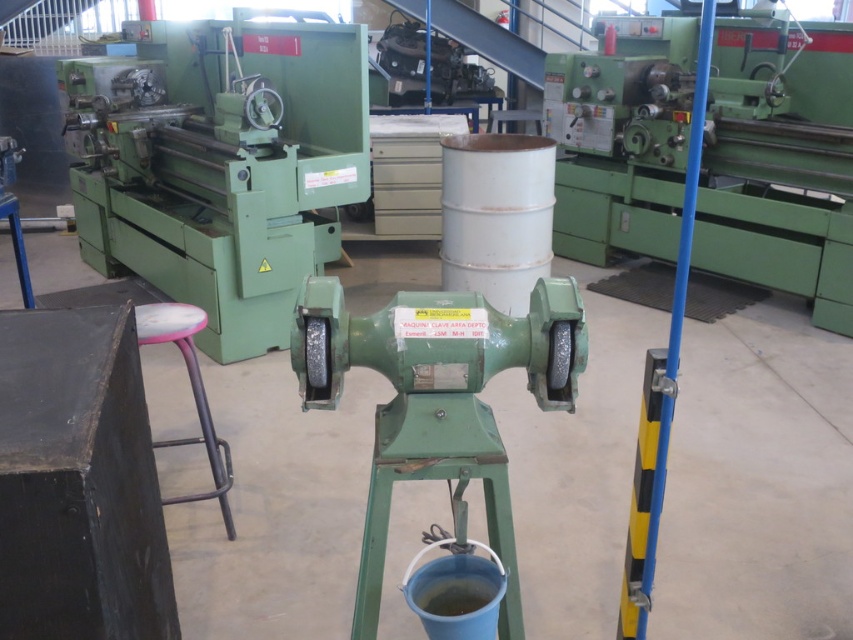
You are an engineer entering the workshop and need to access the control panel of the green metallic grinding machine at center. There is a pink plastic stool at lower left nearby. Can you step over the stool to reach the machine?

The green metallic grinding machine at center is in front of the pink plastic stool at lower left, meaning the stool is behind the machine. Therefore, you would not need to step over the stool to reach the machine as it is already positioned behind the machine.

You are an inspector in the machinery area. You need to move from the pink plastic stool at lower left to the green metallic grinding machine at center. Which direction should you move in?

You should move to the right to reach the green metallic grinding machine at center from the pink plastic stool at lower left because the green metallic grinding machine at center is positioned to the right of the pink plastic stool at lower left.